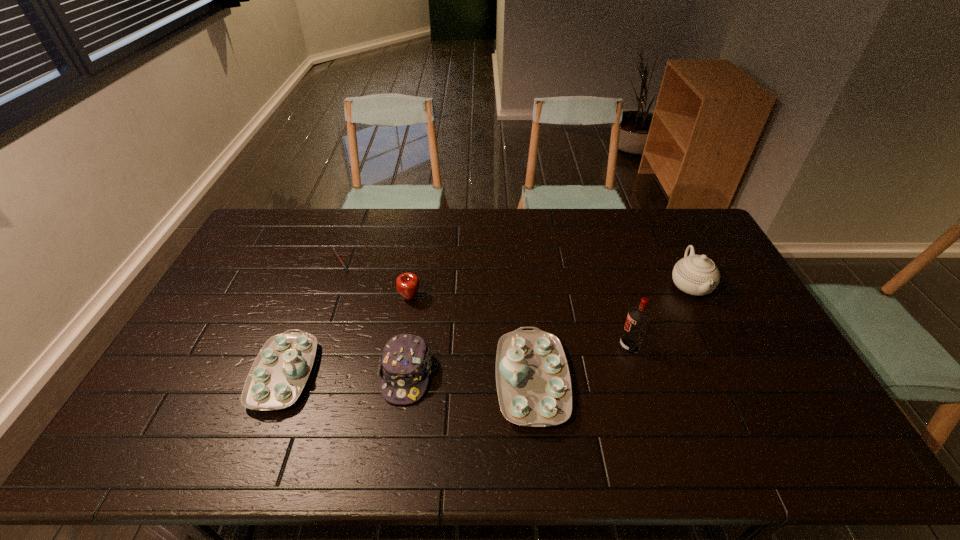
Image resolution: width=960 pixels, height=540 pixels. What are the coordinates of `the shortest chinaware` in the screenshot? It's located at (280, 371).

Find the location of `the third object from right to left`. the third object from right to left is located at coordinates (533, 381).

Image resolution: width=960 pixels, height=540 pixels. I want to click on the rightmost chinaware, so click(697, 275).

Where is `the rightmost object`? The width and height of the screenshot is (960, 540). the rightmost object is located at coordinates (697, 275).

What are the coordinates of `the shortest object` in the screenshot? It's located at (336, 253).

The image size is (960, 540). Identify the location of vodka. (638, 318).

Locate an element on the screen. This screenshot has width=960, height=540. the tallest object is located at coordinates (638, 318).

You are a GUI agent. You are given a task and a screenshot of the screen. Output one action in this format:
    pyautogui.click(x=<x>, y=<y>)
    Task: Click on the apple
    This screenshot has height=540, width=960.
    Given the screenshot: What is the action you would take?
    pyautogui.click(x=407, y=284)

Locate an element on the screen. This screenshot has width=960, height=540. headwear is located at coordinates (405, 363).

Image resolution: width=960 pixels, height=540 pixels. I want to click on free spot located 0.060m on the left of the shortest chinaware, so click(232, 374).